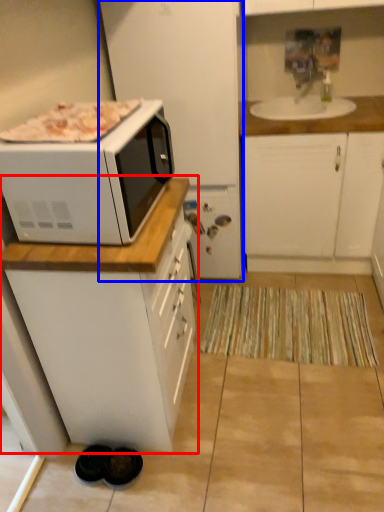
Question: Which of the following is the closest to the observer, cabinetry (highlighted by a red box) or appliance (highlighted by a blue box)?

Choices:
 (A) cabinetry
 (B) appliance

Answer: (A)